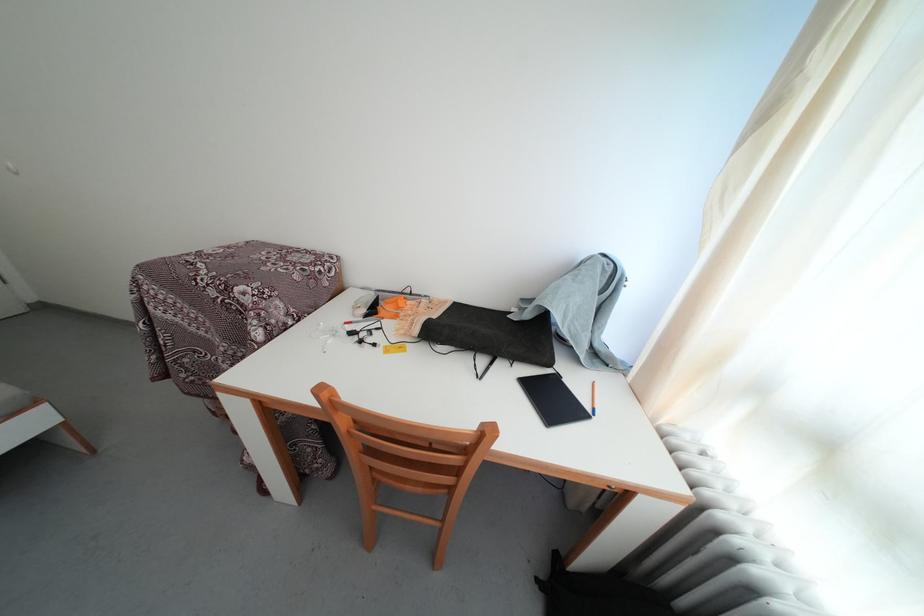
The width and height of the screenshot is (924, 616). Identify the location of black drawing tablet. (553, 400).